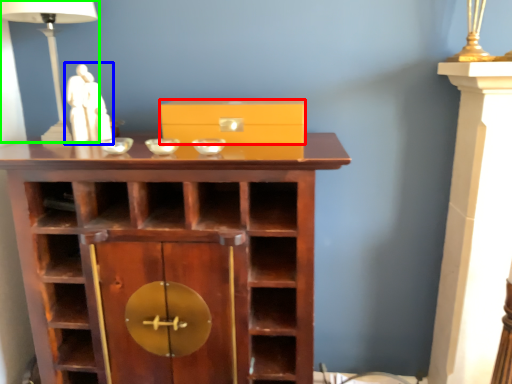
Question: Which object is the farthest from box (highlighted by a red box)? Choose among these: sculpture (highlighted by a blue box) or table lamp (highlighted by a green box).

Choices:
 (A) sculpture
 (B) table lamp

Answer: (B)